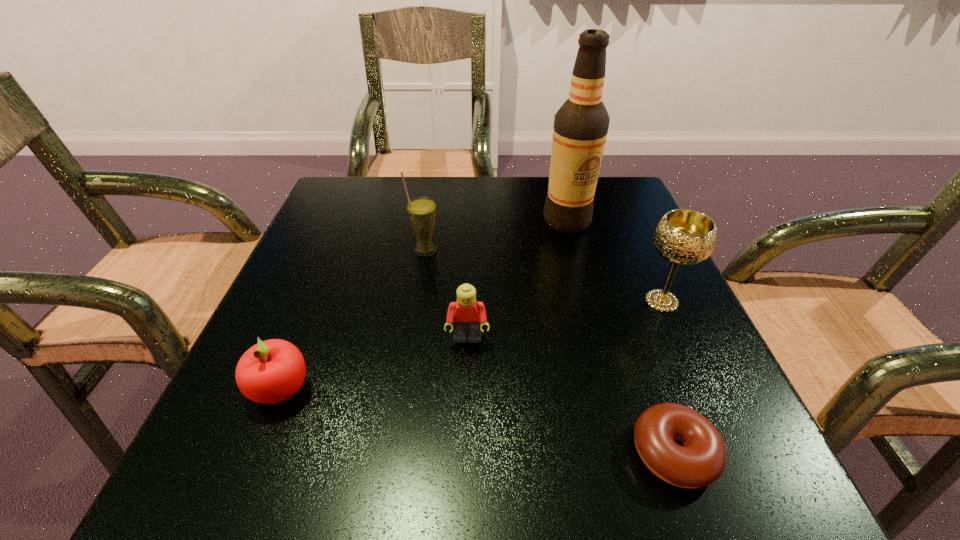
You are a GUI agent. You are given a task and a screenshot of the screen. Output one action in this format:
    pyautogui.click(x=<x>, y=<y>)
    Task: Click on the doughnut present at the right edge
    This screenshot has height=540, width=960.
    Given the screenshot: What is the action you would take?
    pyautogui.click(x=701, y=461)

This screenshot has width=960, height=540. Identify the location of object at the far right corner. (580, 129).

Identify the location of object that is positioned at the near right corner. The height and width of the screenshot is (540, 960). (701, 461).

Find the location of a particular element. The height and width of the screenshot is (540, 960). vacant space at the far edge of the desktop is located at coordinates (439, 207).

In the image, there is a desktop. Where is `free space at the near edge`? free space at the near edge is located at coordinates (519, 504).

Image resolution: width=960 pixels, height=540 pixels. I want to click on vacant space at the left edge of the desktop, so click(353, 252).

At what (x,y) coordinates should I click in order to perform the action: click on vacant space at the right edge of the desktop. Please return your answer as a coordinate pair (x, y). Looking at the image, I should click on (646, 343).

In the image, there is a desktop. Identify the location of vacant space at the far left corner. Image resolution: width=960 pixels, height=540 pixels. (381, 211).

In the image, there is a desktop. Identify the location of vacant space at the near left corner. The height and width of the screenshot is (540, 960). (232, 503).

The width and height of the screenshot is (960, 540). I want to click on unoccupied position between the fifth object from right to left and the shortest object, so click(x=549, y=352).